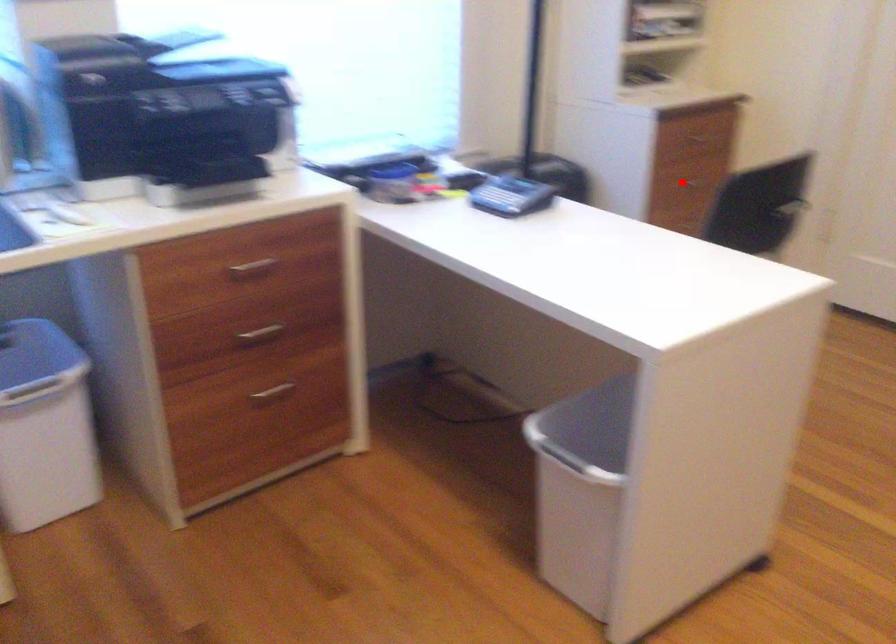
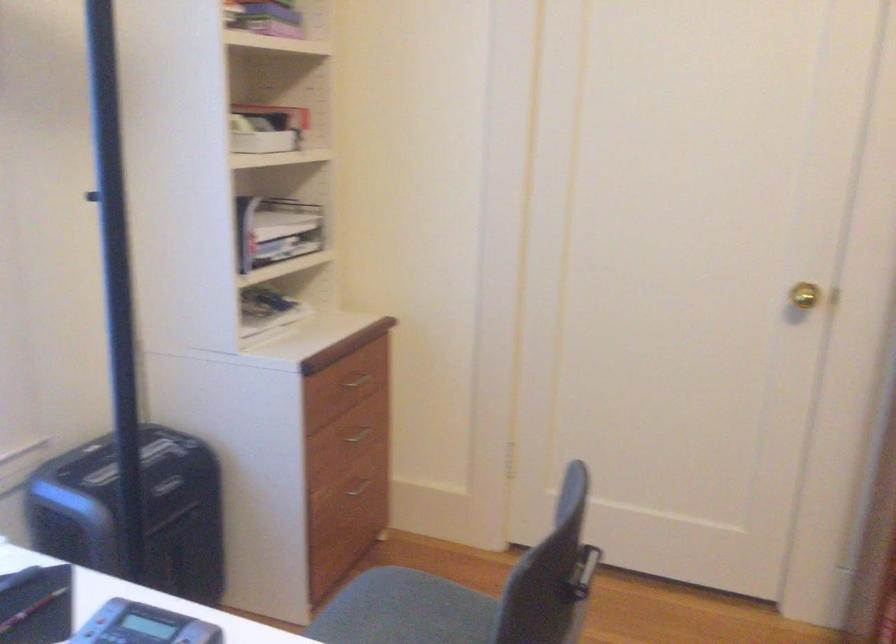
The point at the highlighted location is marked in the first image. Where is the corresponding point in the second image?

(357, 431)